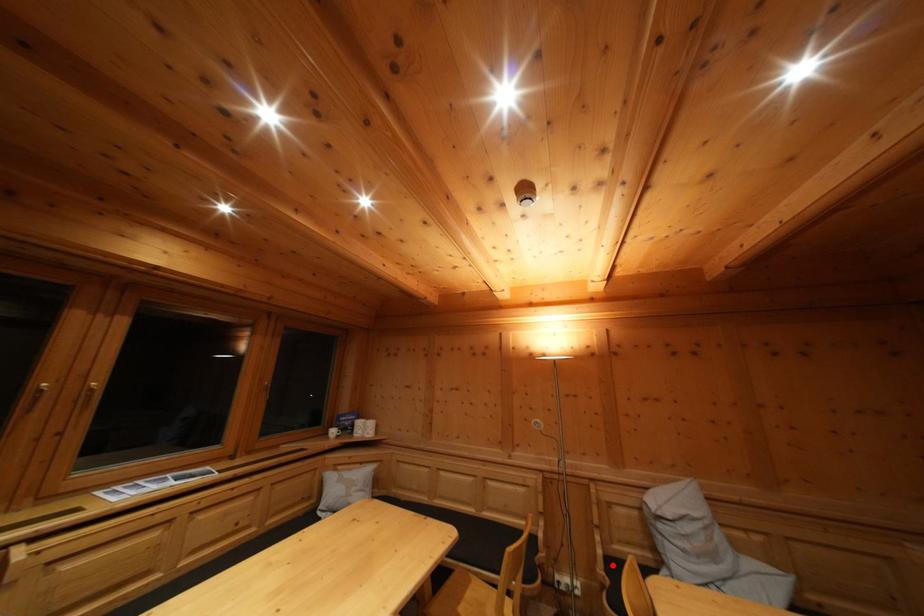
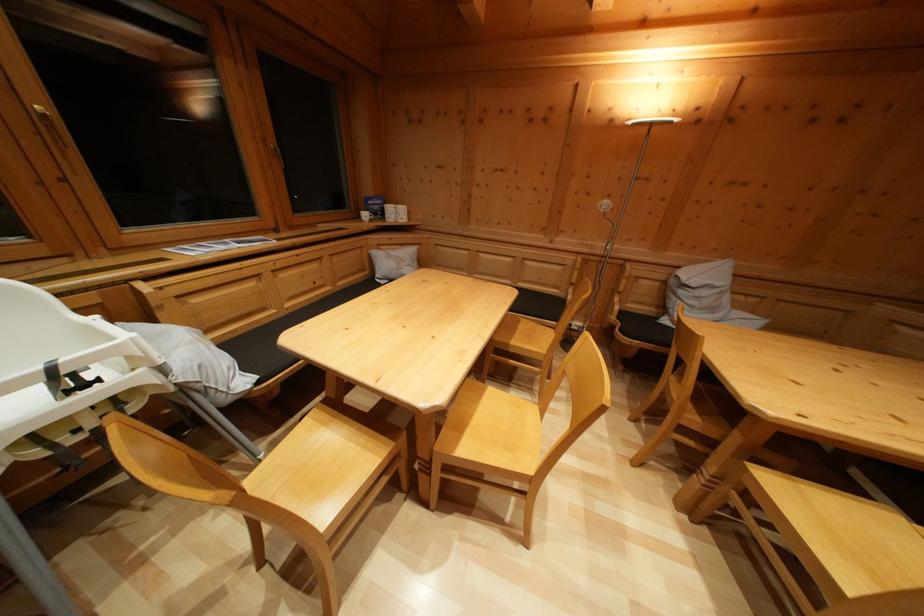
Locate, in the second image, the point that corresponds to the highlighted location in the first image.

(626, 318)